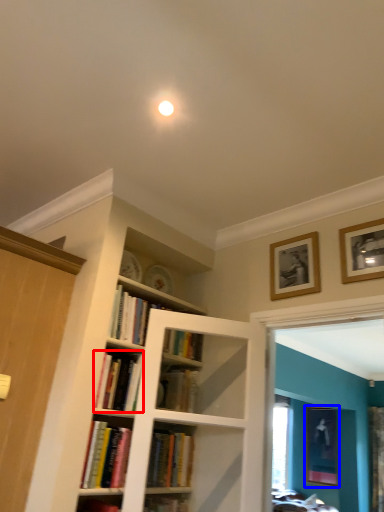
Question: Which point is further to the camera, book (highlighted by a red box) or picture frame (highlighted by a blue box)?

Choices:
 (A) book
 (B) picture frame

Answer: (B)